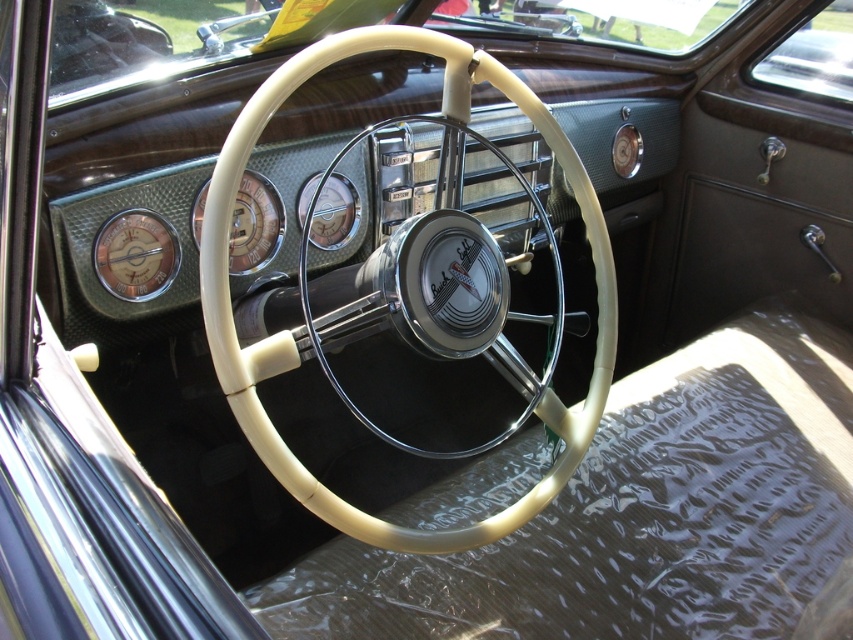
In the scene shown: You are a passenger in the vintage car and want to look at the matte silver gauge at center left. Can you see it clearly through the creamy white steering wheel at center?

The creamy white steering wheel at center is in front of the matte silver gauge at center left, so it may block your view of the matte silver gauge at center left unless you move the steering wheel or adjust your position.